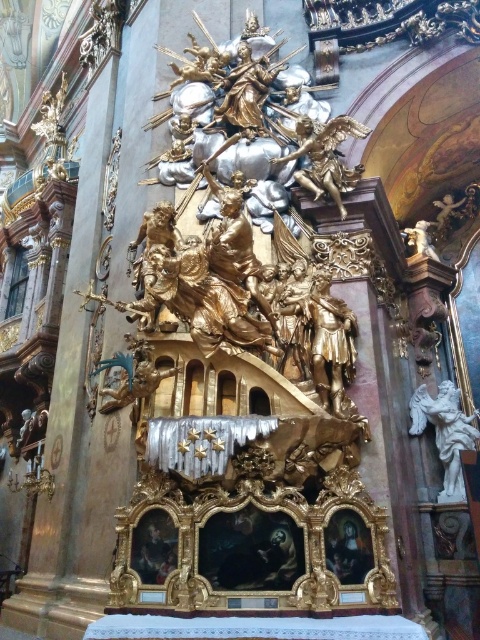
Does gold polished statue at upper center lie behind white marble angel at right?

No, gold polished statue at upper center is closer to the viewer.

Which of these two, gold polished statue at upper center or white marble angel at right, stands shorter?

With less height is gold polished statue at upper center.

Locate an element on the screen. This screenshot has height=640, width=480. gold polished statue at upper center is located at coordinates (324, 156).

Locate an element on the screen. The width and height of the screenshot is (480, 640). gold polished statue at upper center is located at coordinates (324, 156).